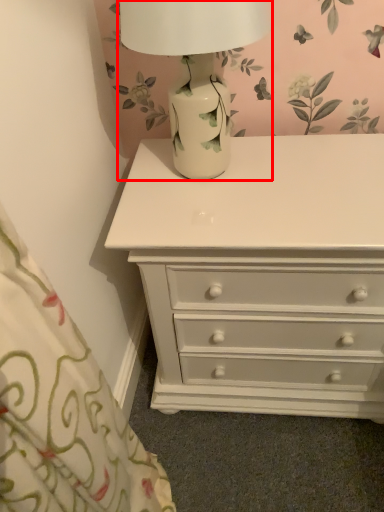
Question: From the image's perspective, where is table lamp (annotated by the red box) located relative to chest of drawers?

Choices:
 (A) below
 (B) above

Answer: (B)